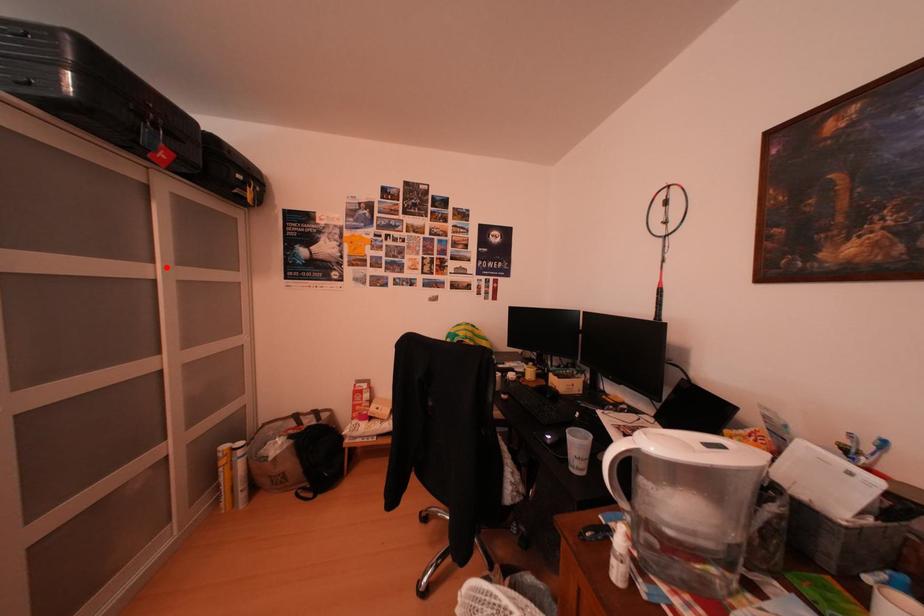
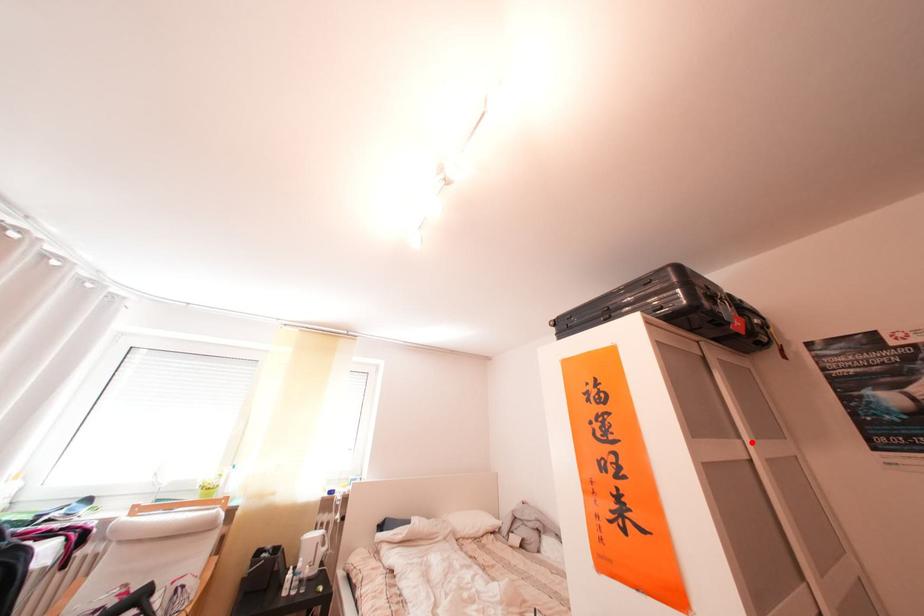
I am providing you with two images of the same scene from different viewpoints. A red point is marked on the first image and another point is marked on the second image. Are the points marked in image1 and image2 representing the same 3D position?

Yes